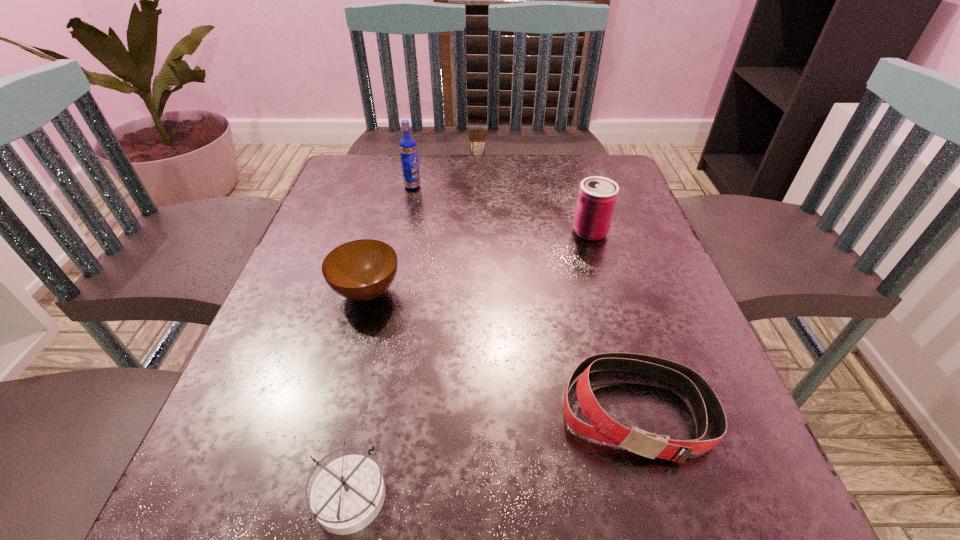
Where is `vacant space at the right edge of the desktop`? The height and width of the screenshot is (540, 960). vacant space at the right edge of the desktop is located at coordinates (x=684, y=417).

You are a GUI agent. You are given a task and a screenshot of the screen. Output one action in this format:
    pyautogui.click(x=<x>, y=<y>)
    Task: Click on the free space at the far left corner of the desktop
    This screenshot has width=960, height=540.
    Given the screenshot: What is the action you would take?
    pyautogui.click(x=390, y=171)

In the image, there is a desktop. At what (x,y) coordinates should I click in order to perform the action: click on vacant space at the far right corner. Please return your answer as a coordinate pair (x, y). Looking at the image, I should click on (612, 172).

Image resolution: width=960 pixels, height=540 pixels. I want to click on vacant point located between the compass and the vodka, so click(x=381, y=340).

Locate an element on the screen. empty space that is in between the dog collar and the bowl is located at coordinates (502, 352).

At what (x,y) coordinates should I click in order to perform the action: click on empty space between the compass and the dog collar. Please return your answer as a coordinate pair (x, y). The width and height of the screenshot is (960, 540). Looking at the image, I should click on click(x=493, y=453).

The image size is (960, 540). In order to click on free point between the third nearest object and the compass in this screenshot , I will do `click(358, 393)`.

This screenshot has width=960, height=540. Identify the location of vacant point located between the can and the vodka. (501, 209).

I want to click on free spot between the tallest object and the bowl, so click(390, 239).

You are a GUI agent. You are given a task and a screenshot of the screen. Output one action in this format:
    pyautogui.click(x=<x>, y=<y>)
    Task: Click on the free area in between the fourth nearest object and the compass
    The image size is (960, 540).
    Given the screenshot: What is the action you would take?
    pyautogui.click(x=469, y=363)